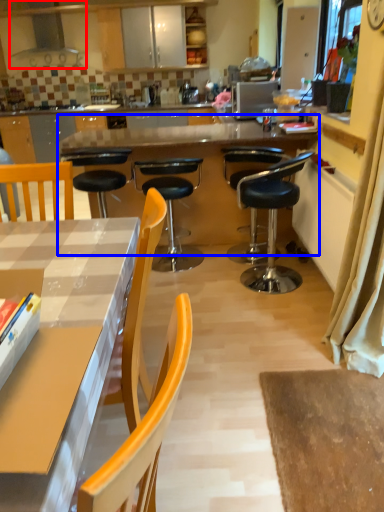
Question: Which object appears closest to the camera in this image, kitchen appliance (highlighted by a red box) or round table (highlighted by a blue box)?

Choices:
 (A) kitchen appliance
 (B) round table

Answer: (B)